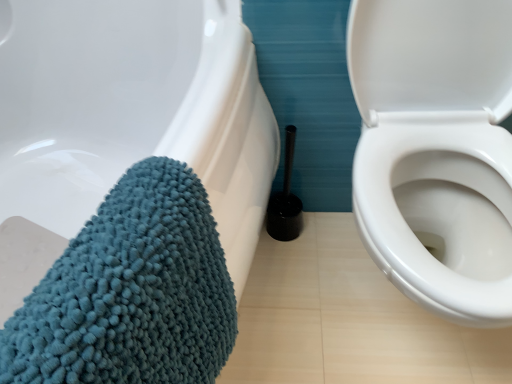
Question: Considering their positions, is black plastic toilet brush at center located in front of or behind teal chenille bath towel at lower left?

Choices:
 (A) behind
 (B) front

Answer: (A)

Question: From a real-world perspective, is black plastic toilet brush at center physically located above or below teal chenille bath towel at lower left?

Choices:
 (A) below
 (B) above

Answer: (A)

Question: From the image's perspective, is black plastic toilet brush at center located above or below teal chenille bath towel at lower left?

Choices:
 (A) above
 (B) below

Answer: (A)

Question: Considering the positions of point (182, 359) and point (292, 200), is point (182, 359) closer or farther from the camera than point (292, 200)?

Choices:
 (A) closer
 (B) farther

Answer: (A)

Question: Is teal chenille bath towel at lower left wider or thinner than black plastic toilet brush at center?

Choices:
 (A) wide
 (B) thin

Answer: (A)

Question: Considering the positions of teal chenille bath towel at lower left and black plastic toilet brush at center in the image, is teal chenille bath towel at lower left bigger or smaller than black plastic toilet brush at center?

Choices:
 (A) small
 (B) big

Answer: (B)

Question: Considering the relative positions of teal chenille bath towel at lower left and black plastic toilet brush at center in the image provided, is teal chenille bath towel at lower left to the left or to the right of black plastic toilet brush at center?

Choices:
 (A) left
 (B) right

Answer: (A)